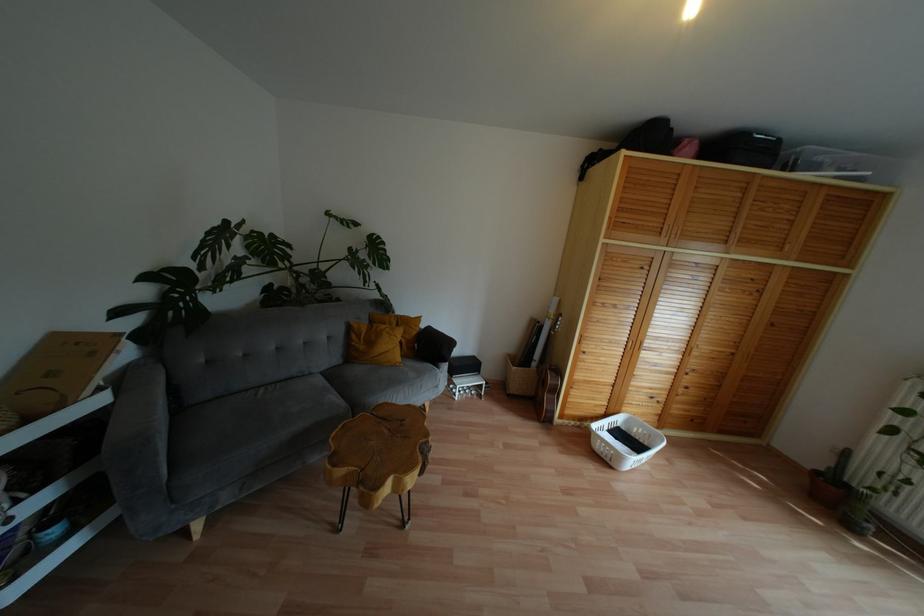
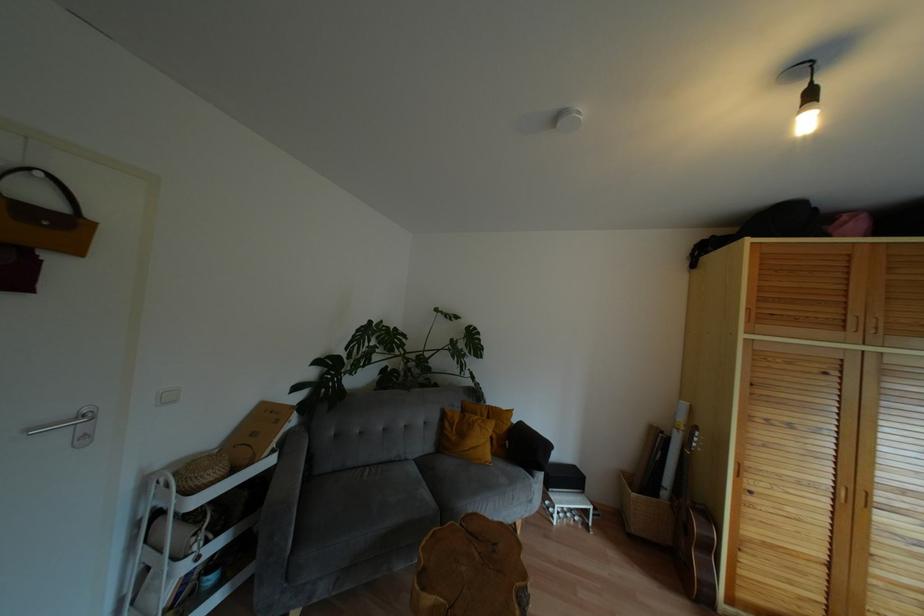
In the second image, find the point that corresponds to (x=418, y=318) in the first image.

(508, 411)